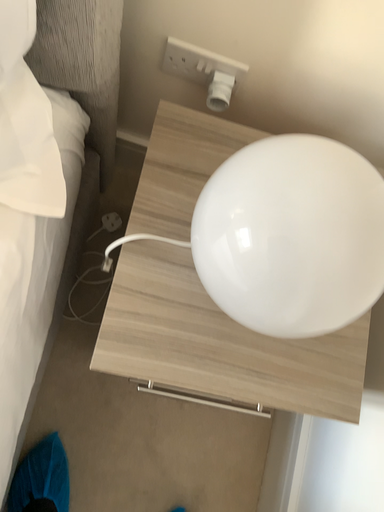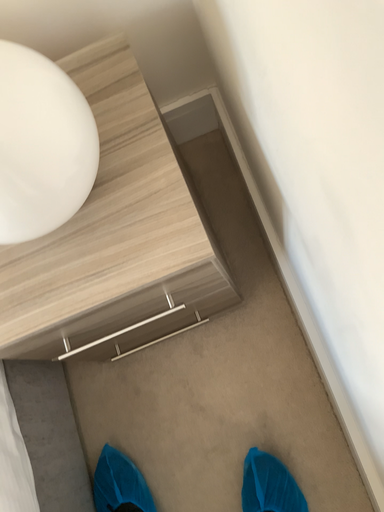
Question: How did the camera likely rotate when shooting the video?

Choices:
 (A) rotated right
 (B) rotated left

Answer: (B)